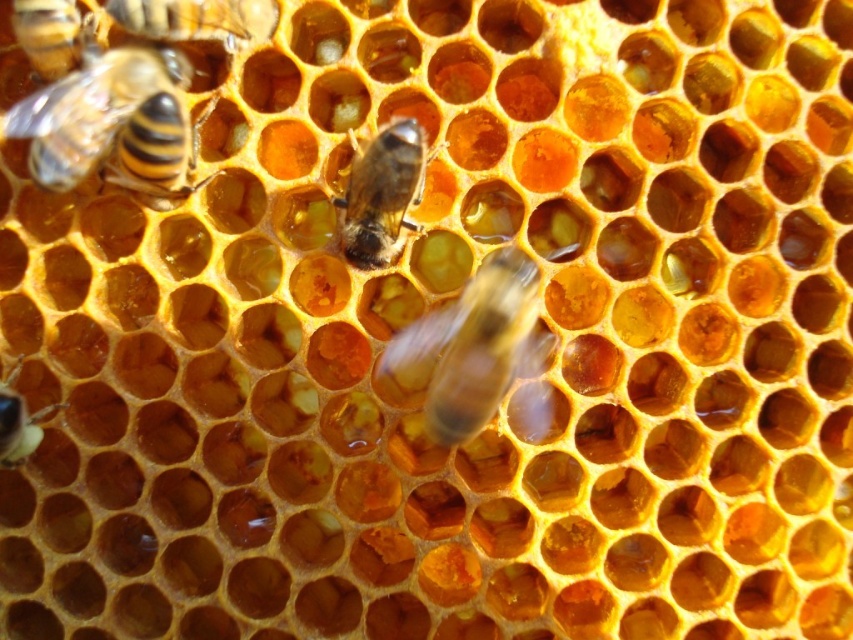
Measure the distance between translucent amber bee at center and shiny golden honeycomb at center.

translucent amber bee at center and shiny golden honeycomb at center are 6.48 inches apart from each other.

Between translucent amber bee at center and shiny golden honeycomb at center, which one appears on the left side from the viewer's perspective?

From the viewer's perspective, shiny golden honeycomb at center appears more on the left side.

Describe the element at coordinates (474, 346) in the screenshot. The width and height of the screenshot is (853, 640). I see `translucent amber bee at center` at that location.

This screenshot has width=853, height=640. What are the coordinates of `translucent amber bee at center` in the screenshot? It's located at (474, 346).

Between yellow-brown translucent bee at upper left and translucent amber bee at center, which one is positioned higher?

yellow-brown translucent bee at upper left is above.

Measure the distance from yellow-brown translucent bee at upper left to translucent amber bee at center.

They are 44.31 centimeters apart.

I want to click on yellow-brown translucent bee at upper left, so click(x=113, y=124).

I want to click on yellow-brown translucent bee at upper left, so click(113, 124).

Is shiny golden honeycomb at center further to the viewer compared to translucent yellowish honeycomb at upper left?

That is True.

Who is more forward, (402, 193) or (55, 45)?

Point (55, 45) is more forward.

Locate an element on the screen. shiny golden honeycomb at center is located at coordinates (381, 193).